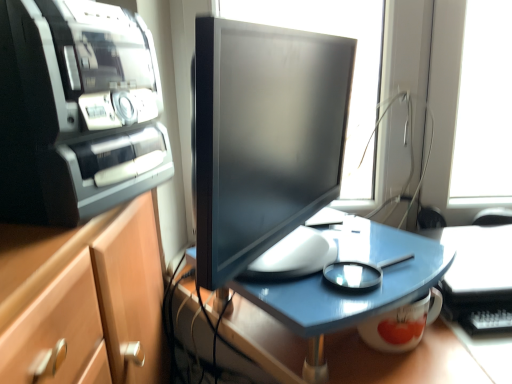
Describe the element at coordinates (76, 111) in the screenshot. The width and height of the screenshot is (512, 384). I see `black plastic printer at left` at that location.

Where is `black plastic printer at left`? The image size is (512, 384). black plastic printer at left is located at coordinates (76, 111).

Measure the distance between point (60, 99) and camera.

The depth of point (60, 99) is 21.57 inches.

Where is `black plastic printer at left`? This screenshot has height=384, width=512. black plastic printer at left is located at coordinates (76, 111).